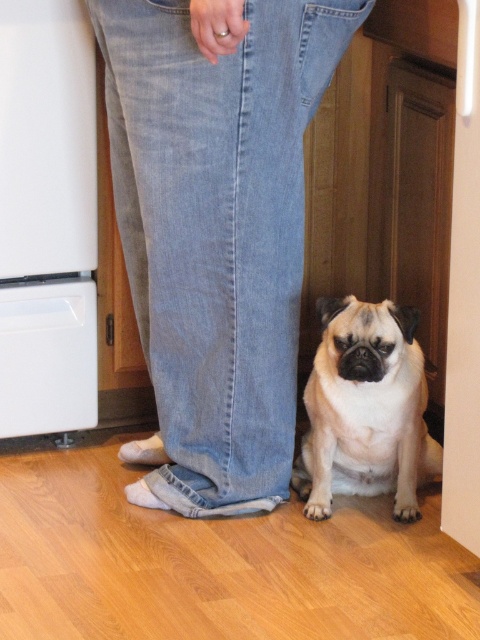
Question: Observing the image, what is the correct spatial positioning of light blue denim jeans at lower center in reference to white fur dog at lower center?

Choices:
 (A) left
 (B) right

Answer: (A)

Question: Among these objects, which one is nearest to the camera?

Choices:
 (A) light blue denim jeans at lower center
 (B) white fur dog at lower center

Answer: (A)

Question: Which point is farther from the camera taking this photo?

Choices:
 (A) (203, 100)
 (B) (428, 458)

Answer: (B)

Question: Can you confirm if light blue denim jeans at lower center is smaller than white fur dog at lower center?

Choices:
 (A) no
 (B) yes

Answer: (A)

Question: Does light blue denim jeans at lower center appear under white fur dog at lower center?

Choices:
 (A) no
 (B) yes

Answer: (A)